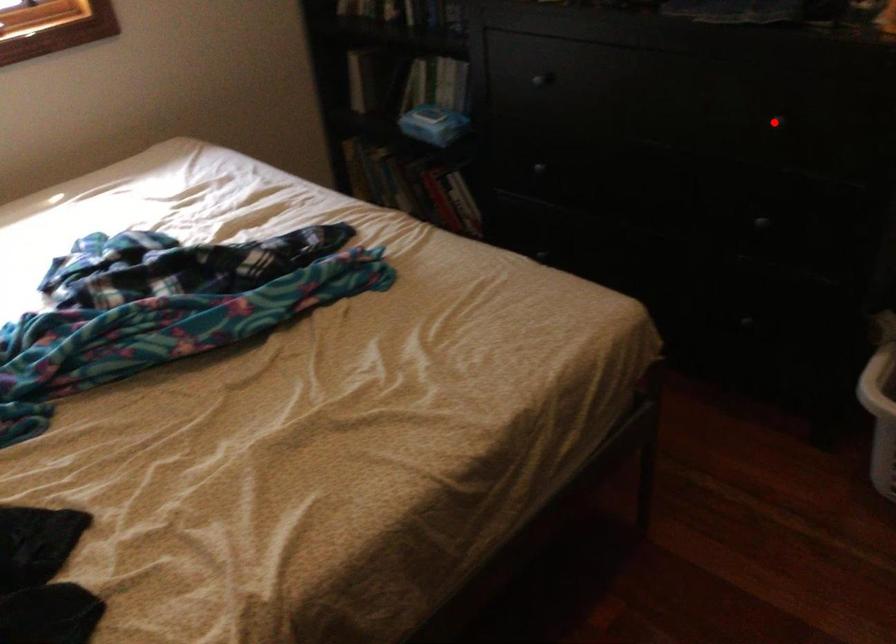
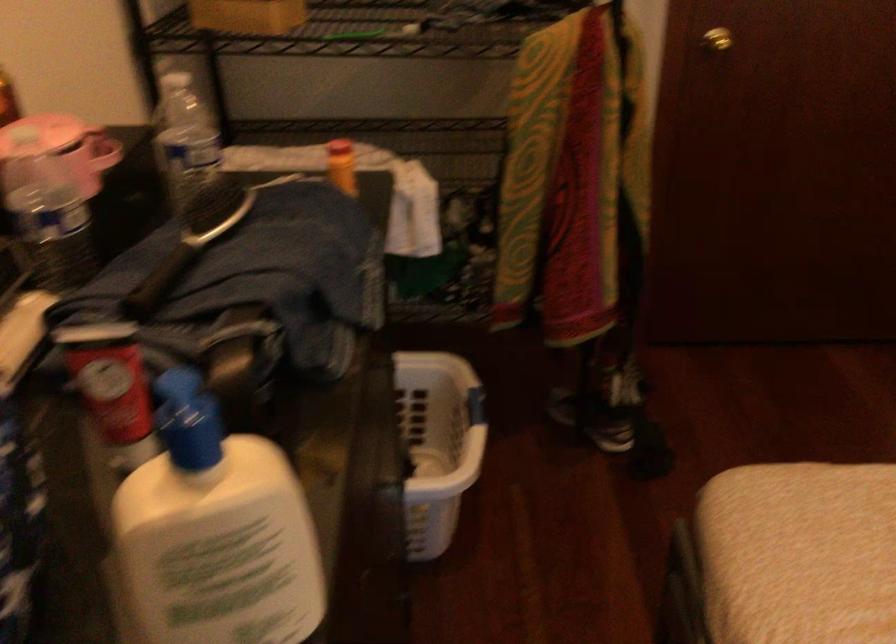
Question: I am providing you with two images of the same scene from different viewpoints. A red point is marked on the first image. At the location where the point appears in image 1, is it still visible in image 2?

Choices:
 (A) Yes
 (B) No

Answer: (B)